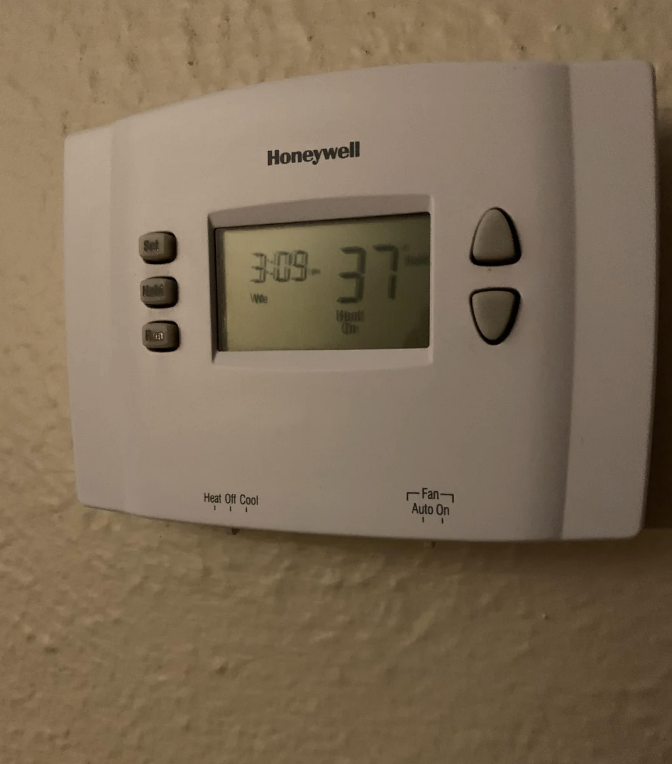
Find the location of a particular element. The image size is (672, 764). push button is located at coordinates (168, 243).